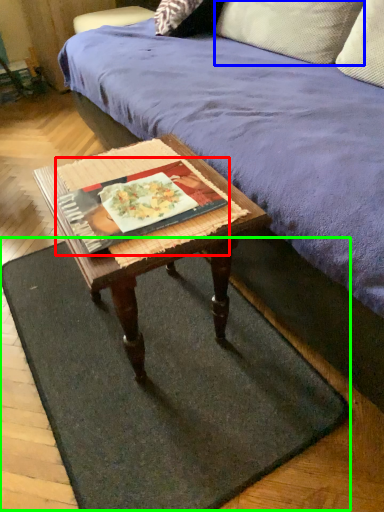
Question: Which is nearer to the book (highlighted by a red box)? pillow (highlighted by a blue box) or doormat (highlighted by a green box).

Choices:
 (A) pillow
 (B) doormat

Answer: (B)